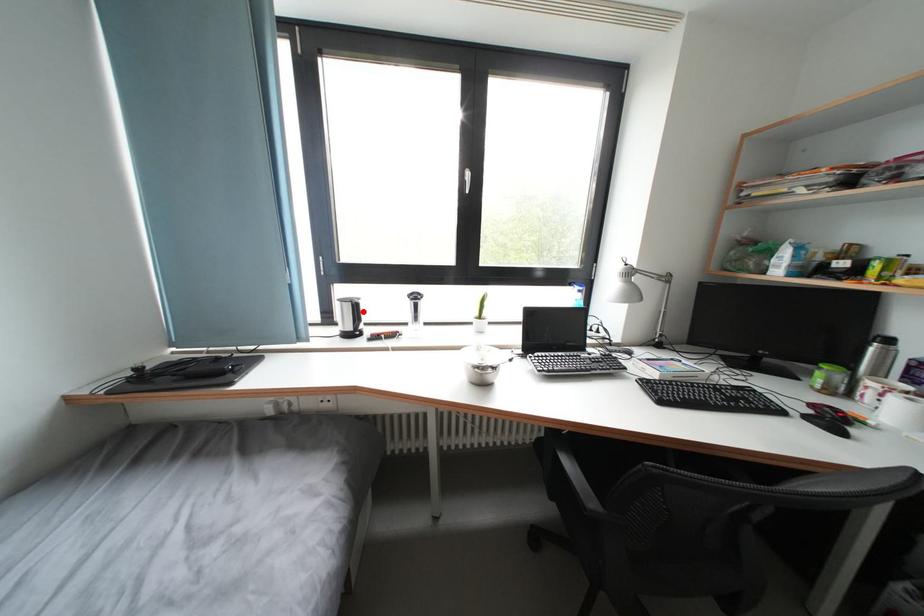
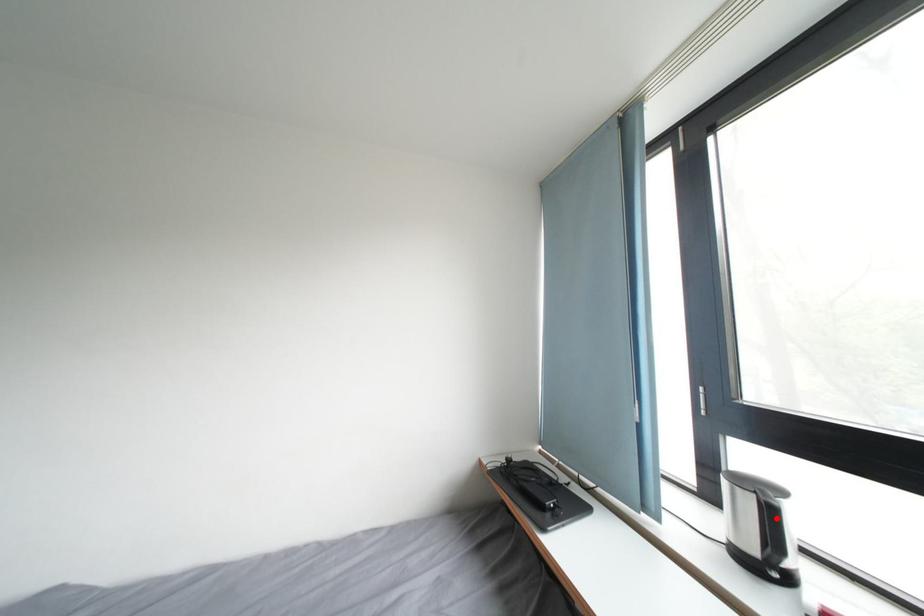
I am providing you with two images of the same scene from different viewpoints. A red point is marked on the first image and another point is marked on the second image. Is the red point in image1 aligned with the point shown in image2?

Yes